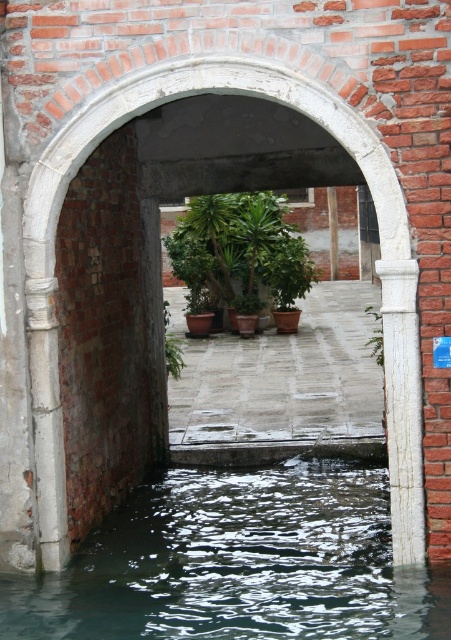
You are a gardener who needs to move the green leafy plant at center to a different location. Which direction should you move it so that it is no longer under the green matte plant at center?

The green matte plant at center is positioned over the green leafy plant at center. To move the green leafy plant at center so it is no longer under the green matte plant at center, you should move it in any direction away from the current central position where it is covered by the green matte plant at center.

You are a maintenance worker needing to place a 20 feet long safety barrier between the white marble pillar at right and the green leafy plant at center. Based on the scene description, will the barrier fit without overlapping either object?

The distance between the white marble pillar at right and the green leafy plant at center is 22.98 feet. Since the barrier is 20 feet long, it will fit within the space without overlapping either object.